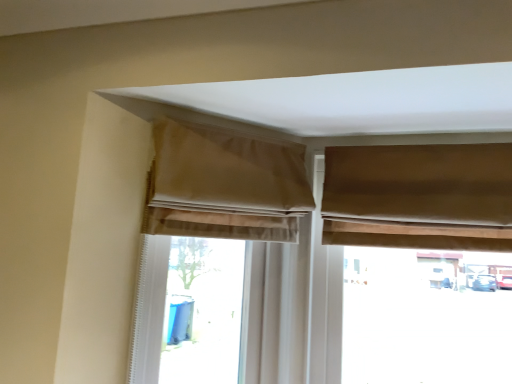
The height and width of the screenshot is (384, 512). I want to click on free location above matte brown curtain at upper right, marked as the 3th curtain in a left-to-right arrangement (from a real-world perspective), so click(423, 137).